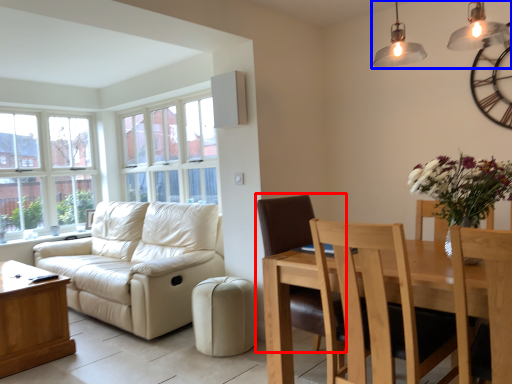
Question: Which point is closer to the camera, chair (highlighted by a red box) or lamp (highlighted by a blue box)?

Choices:
 (A) chair
 (B) lamp

Answer: (B)